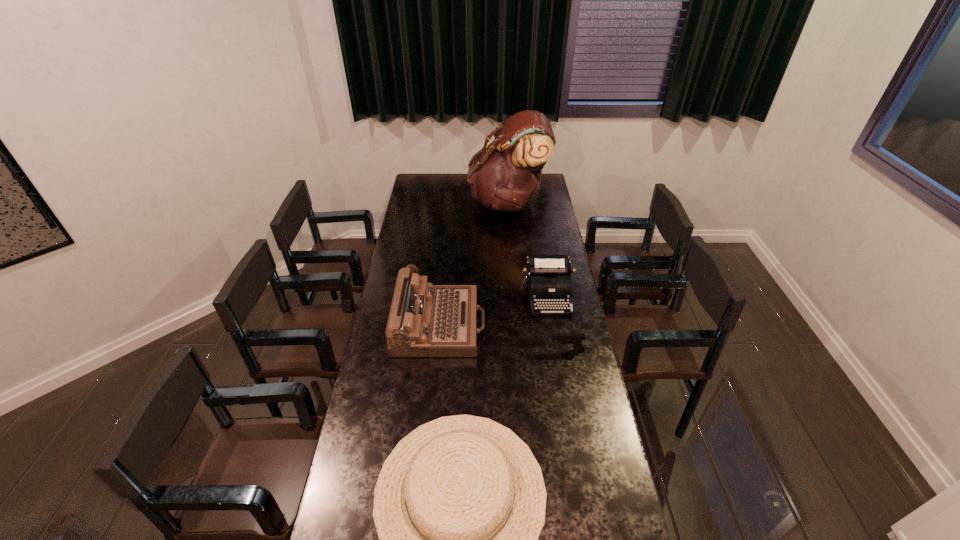
Where is `satchel`? The image size is (960, 540). satchel is located at coordinates (504, 176).

I want to click on the farthest object, so click(504, 176).

You are a GUI agent. You are given a task and a screenshot of the screen. Output one action in this format:
    pyautogui.click(x=<x>, y=<y>)
    Task: Click on the left typewriter
    The image size is (960, 540).
    Given the screenshot: What is the action you would take?
    pyautogui.click(x=425, y=320)

In order to click on the fourth shortest object in this screenshot , I will do `click(425, 320)`.

Where is `the right typewriter`? The height and width of the screenshot is (540, 960). the right typewriter is located at coordinates (549, 282).

The image size is (960, 540). In order to click on the shorter typewriter in this screenshot , I will do `click(549, 282)`.

The height and width of the screenshot is (540, 960). In order to click on pistol in this screenshot , I will do `click(576, 339)`.

The width and height of the screenshot is (960, 540). Identify the location of vacant space situated at the front of the satchel with buckles. (433, 202).

Where is `vacant region located at the front of the satchel with buckles`? This screenshot has width=960, height=540. vacant region located at the front of the satchel with buckles is located at coordinates (419, 202).

Locate an element on the screen. Image resolution: width=960 pixels, height=540 pixels. free point located 0.070m at the front of the satchel with buckles is located at coordinates (456, 202).